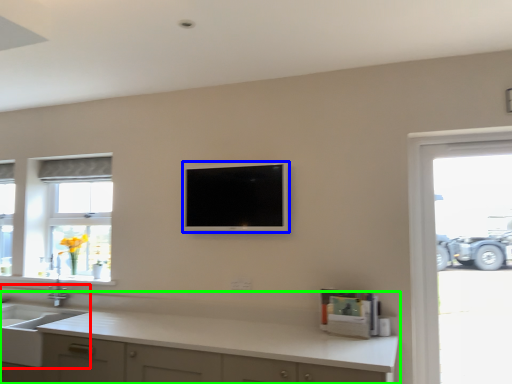
Question: Which object is positioned farthest from sink (highlighted by a red box)? Select from television (highlighted by a blue box) and countertop (highlighted by a green box).

Choices:
 (A) television
 (B) countertop

Answer: (A)